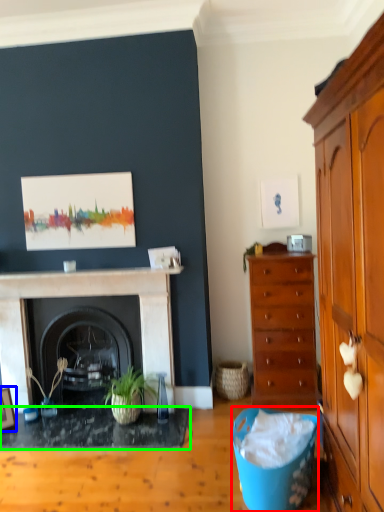
Question: Which is nearer to the trash bin/can (highlighted by a red box)? picture frame (highlighted by a blue box) or desk (highlighted by a green box).

Choices:
 (A) picture frame
 (B) desk

Answer: (B)